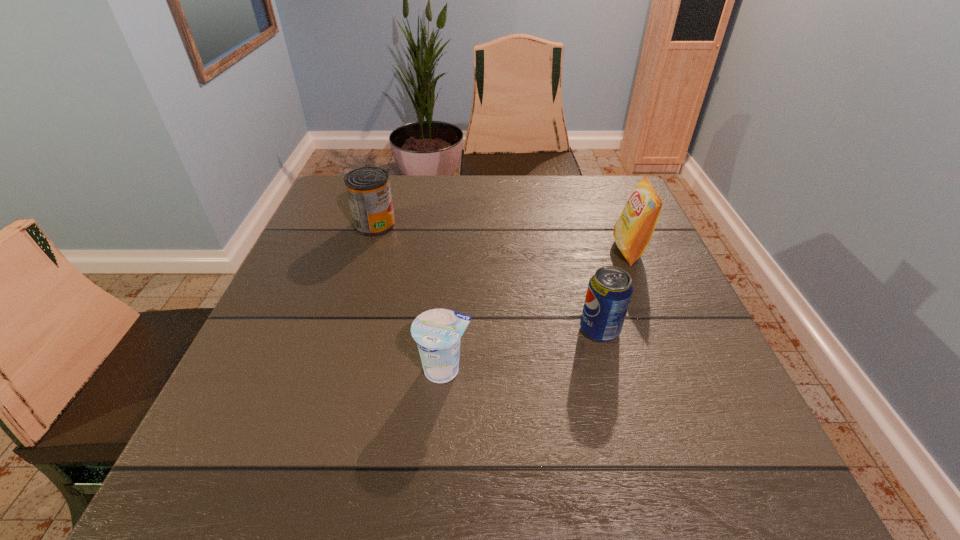
Find the location of a particular element. free spot located 0.390m on the left of the third object from left to right is located at coordinates (383, 330).

Where is `vacant region located on the left of the leftmost object`? The height and width of the screenshot is (540, 960). vacant region located on the left of the leftmost object is located at coordinates (328, 225).

The image size is (960, 540). I want to click on free spot located on the back of the nearest object, so click(449, 299).

Where is `object present at the far edge`? This screenshot has width=960, height=540. object present at the far edge is located at coordinates (368, 189).

The width and height of the screenshot is (960, 540). What are the coordinates of `object at the left edge` in the screenshot? It's located at (368, 189).

I want to click on object positioned at the right edge, so click(x=633, y=230).

The image size is (960, 540). Identify the location of object that is at the far left corner. (368, 189).

Find the location of `free space at the far edge`. free space at the far edge is located at coordinates (530, 196).

Find the location of `vacant space at the near edge of the desktop`. vacant space at the near edge of the desktop is located at coordinates (360, 490).

Identify the location of vacant region at the left edge of the desktop. The height and width of the screenshot is (540, 960). (324, 289).